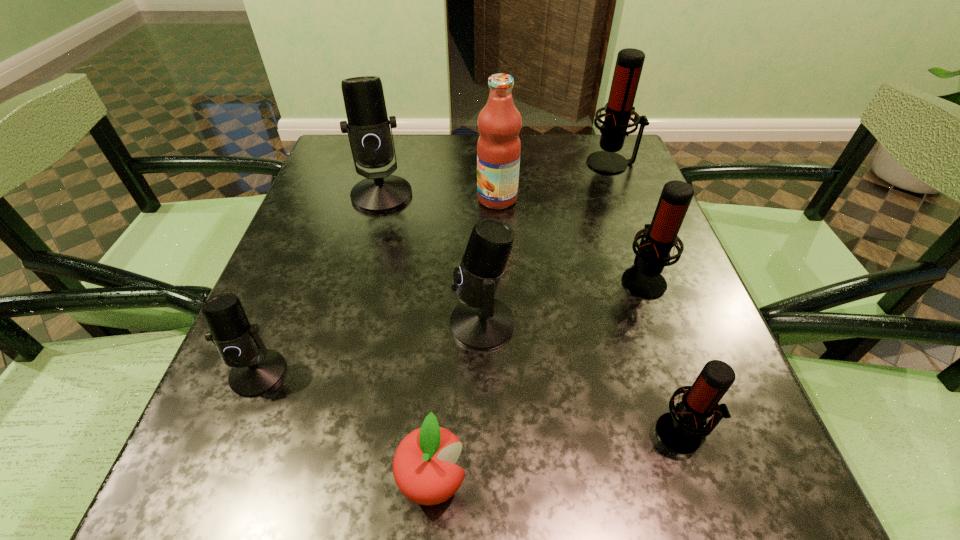
Locate which red microphone is the second closest to the smallest red microphone. Please provide its 2D coordinates. Your answer should be formatted as a tuple, i.e. [(x, y)], where the tuple contains the x and y coordinates of a point satisfying the conditions above.

[(619, 110)]

Identify which black microphone is located as the nearest to the smallest black microphone. Please provide its 2D coordinates. Your answer should be formatted as a tuple, i.e. [(x, y)], where the tuple contains the x and y coordinates of a point satisfying the conditions above.

[(480, 322)]

Identify which black microphone is the second nearest to the second farthest red microphone. Please provide its 2D coordinates. Your answer should be formatted as a tuple, i.e. [(x, y)], where the tuple contains the x and y coordinates of a point satisfying the conditions above.

[(368, 128)]

Locate an element on the screen. This screenshot has width=960, height=540. vacant area that satisfies the following two spatial constraints: 1. on the back side of the third farthest microphone; 2. on the front label of the fruit juice is located at coordinates (614, 199).

Identify the location of vacant space that satisfies the following two spatial constraints: 1. on the back side of the nearest red microphone; 2. on the stand of the second smallest black microphone. This screenshot has width=960, height=540. (647, 323).

I want to click on vacant space that satisfies the following two spatial constraints: 1. on the front label of the fruit juice; 2. on the stand of the smallest black microphone, so click(505, 373).

Find the location of a particular element. The width and height of the screenshot is (960, 540). free space that satisfies the following two spatial constraints: 1. on the front label of the second biggest red microphone; 2. on the left side of the fruit juice is located at coordinates pyautogui.click(x=501, y=279).

Where is `free space that satisfies the following two spatial constraints: 1. on the stand of the apple; 2. on the left side of the fifth nearest microphone`? This screenshot has height=540, width=960. free space that satisfies the following two spatial constraints: 1. on the stand of the apple; 2. on the left side of the fifth nearest microphone is located at coordinates (306, 481).

In order to click on vacant position in the image that satisfies the following two spatial constraints: 1. on the stand of the third nearest microphone; 2. on the left side of the nearest microphone in this screenshot , I will do `click(483, 433)`.

I want to click on free space that satisfies the following two spatial constraints: 1. on the stand of the second biggest red microphone; 2. on the right side of the second farthest microphone, so click(x=360, y=279).